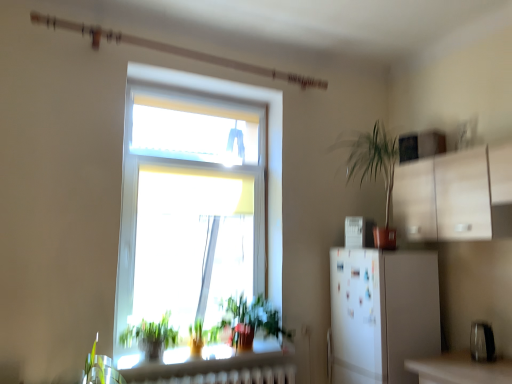
Question: Looking at their shapes, would you say metallic silver toaster at lower right, the 2th appliance when ordered from back to front, is wider or thinner than green leafy plant at lower center, the 2th vegetation from the left?

Choices:
 (A) wide
 (B) thin

Answer: (B)

Question: In the image, is metallic silver toaster at lower right, which is counted as the 2th appliance, starting from the left, positioned in front of or behind green leafy plant at lower center, the 2th vegetation from the left?

Choices:
 (A) behind
 (B) front

Answer: (B)

Question: Considering the real-world distances, which object is closest to the metallic silver toaster at lower right, the 1th appliance from the bottom?

Choices:
 (A) green leafy plant at lower left, the first vegetation in the left-to-right sequence
 (B) green leafy plant at lower center, the 2th vegetation from the left
 (C) white glossy refrigerator at right, the 2th appliance when ordered from right to left

Answer: (C)

Question: Estimate the real-world distances between objects in this image. Which object is farther from the green leafy plant at lower left, the first vegetation in the left-to-right sequence?

Choices:
 (A) metallic silver toaster at lower right, placed as the first appliance when sorted from front to back
 (B) white glossy refrigerator at right, acting as the first appliance starting from the top
 (C) green leafy plant at lower center, acting as the first vegetation starting from the right

Answer: (A)